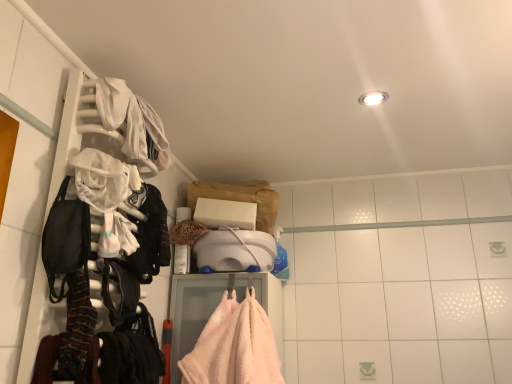
Question: Is striped wool scarf at left, the second clothing when ordered from back to front, bigger or smaller than white fabric at upper left, the 2th clothing when ordered from bottom to top?

Choices:
 (A) big
 (B) small

Answer: (B)

Question: In terms of width, does striped wool scarf at left, the 1th clothing in the front-to-back sequence, look wider or thinner when compared to white fabric at upper left, the 2th clothing when ordered from bottom to top?

Choices:
 (A) wide
 (B) thin

Answer: (B)

Question: Considering the real-world distances, which object is farthest from the white plastic hanger at left?

Choices:
 (A) striped wool scarf at left, the 1th clothing in the front-to-back sequence
 (B) black fabric backpack at left
 (C) white fabric at upper left, marked as the first clothing in a top-to-bottom arrangement

Answer: (A)

Question: Which object is the closest to the black fabric backpack at left?

Choices:
 (A) white plastic hanger at left
 (B) white fabric at upper left, arranged as the first clothing when viewed from the back
 (C) striped wool scarf at left, which is the 2th clothing from top to bottom

Answer: (C)